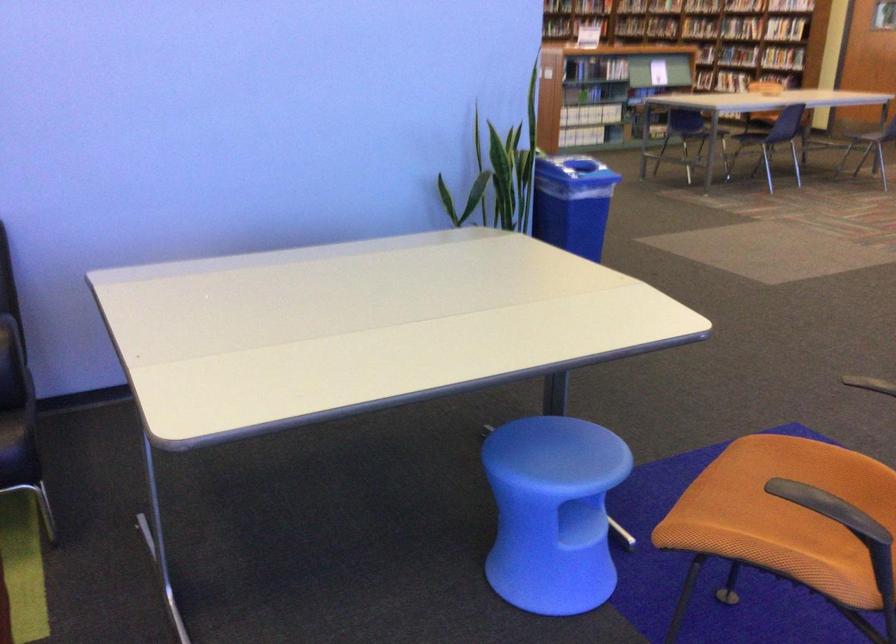
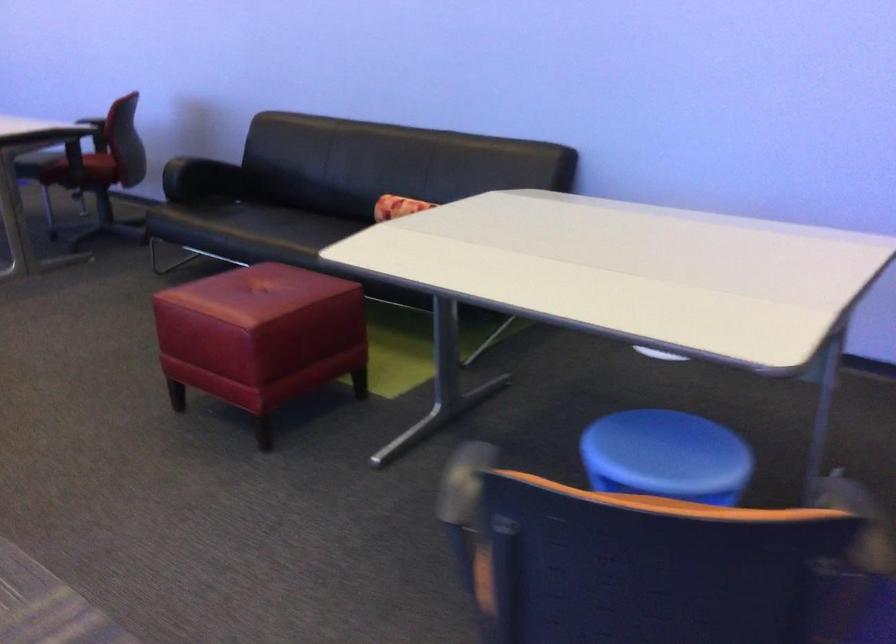
The point at (580, 451) is marked in the first image. Where is the corresponding point in the second image?

(666, 456)